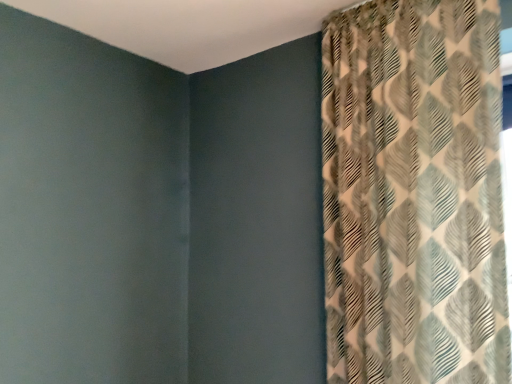
In order to face patterned fabric curtain at upper right, should I rotate leftwards or rightwards?

You should rotate right by 18.164 degrees.

This screenshot has width=512, height=384. I want to click on patterned fabric curtain at upper right, so click(414, 194).

This screenshot has width=512, height=384. What do you see at coordinates (414, 194) in the screenshot?
I see `patterned fabric curtain at upper right` at bounding box center [414, 194].

The height and width of the screenshot is (384, 512). I want to click on patterned fabric curtain at upper right, so click(414, 194).